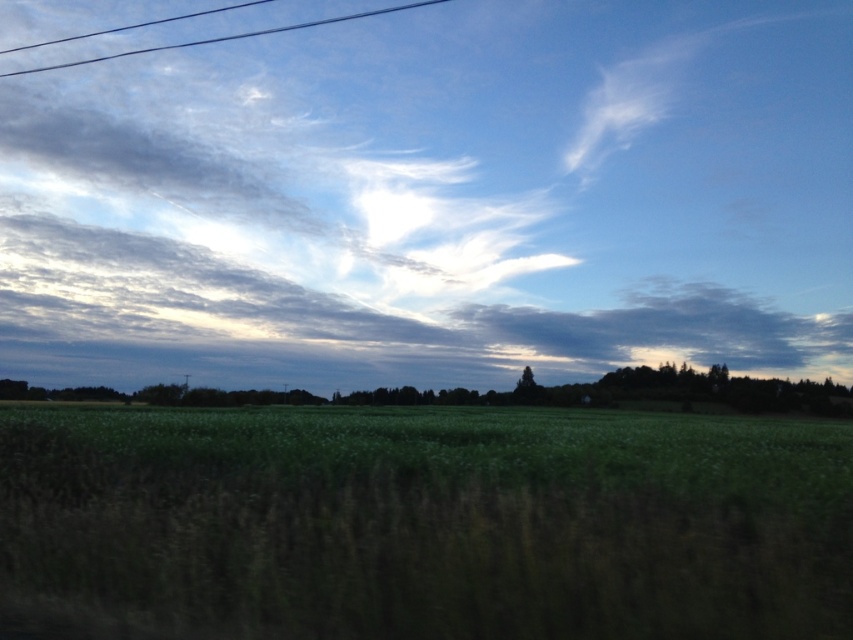
You are standing at the origin point of this rural landscape. You need to place a small garden ornament exactly at the coordinates given for the green grass at center. What are the coordinates where you should place the ornament?

The coordinates for the green grass at center are at point (x=428, y=522), so you should place the ornament there.

You are a farmer checking the irrigation system. You notice the green grass at center and the black wire at upper left. Which one is located to the right of the other?

The green grass at center is positioned on the right side of black wire at upper left.